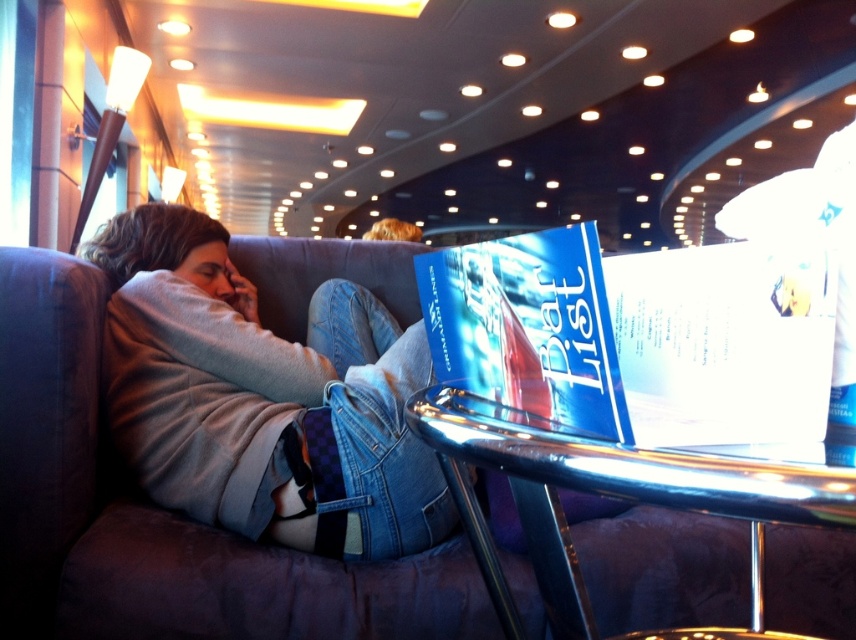
In the scene shown: You are organizing a bookshelf and need to place the blue glossy book at center and the shiny metallic table at lower center. Which object should you place first if you want to arrange them from shortest to tallest?

The blue glossy book at center is shorter than the shiny metallic table at lower center, so you should place the blue glossy book at center first when arranging from shortest to tallest.

You are a guest in this lounge and want to place a small drink on the shiny metallic table at lower center without it falling off. Considering the blue glossy book at center is in the way, where should you move the book to make space?

The shiny metallic table at lower center is behind the blue glossy book at center, so you should move the blue glossy book at center forward to access the table and place the drink safely.

You are organizing a bookshelf and need to place the blue glossy book at center and the shiny metallic table at lower center. Based on their positions in the image, which object is closer to the left side of the scene?

The blue glossy book at center is to the left of the shiny metallic table at lower center, so the blue glossy book at center is closer to the left side of the scene.